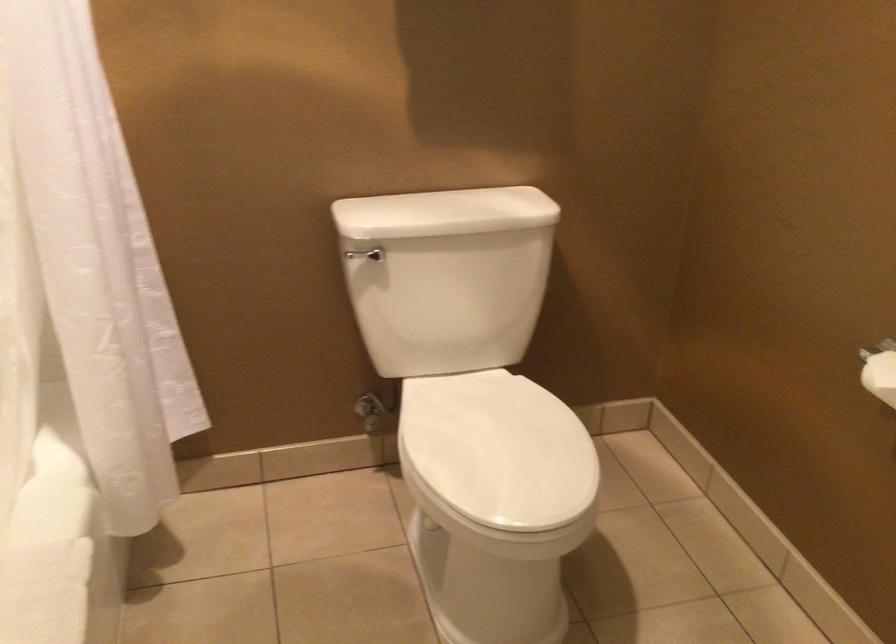
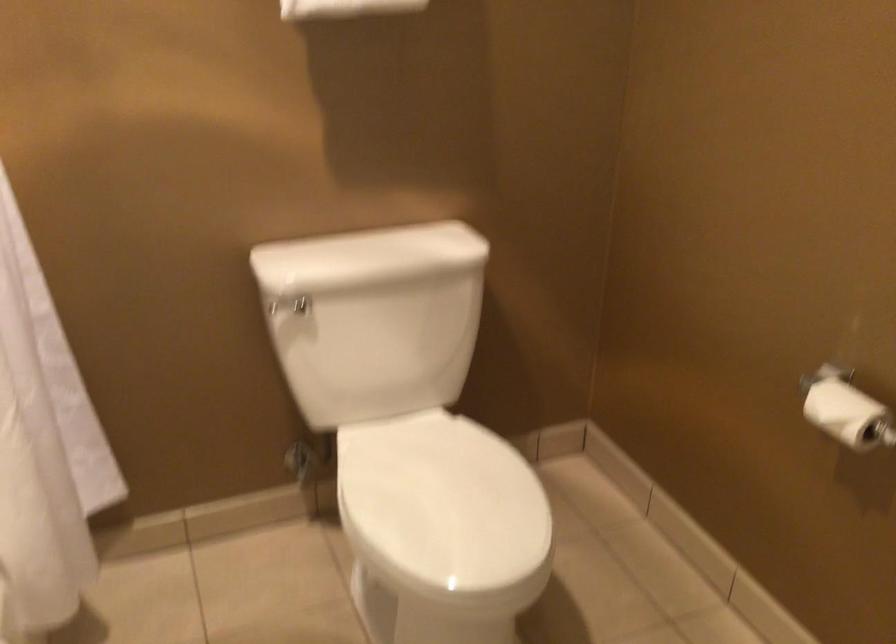
Where in the second image is the point corresponding to pixel 135 365 from the first image?

(44, 444)